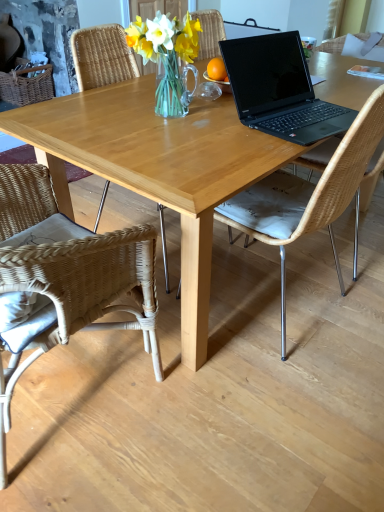
In order to click on vacant space in front of natural wicker chair at center, which is the 1th chair in right-to-left order in this screenshot , I will do `click(283, 418)`.